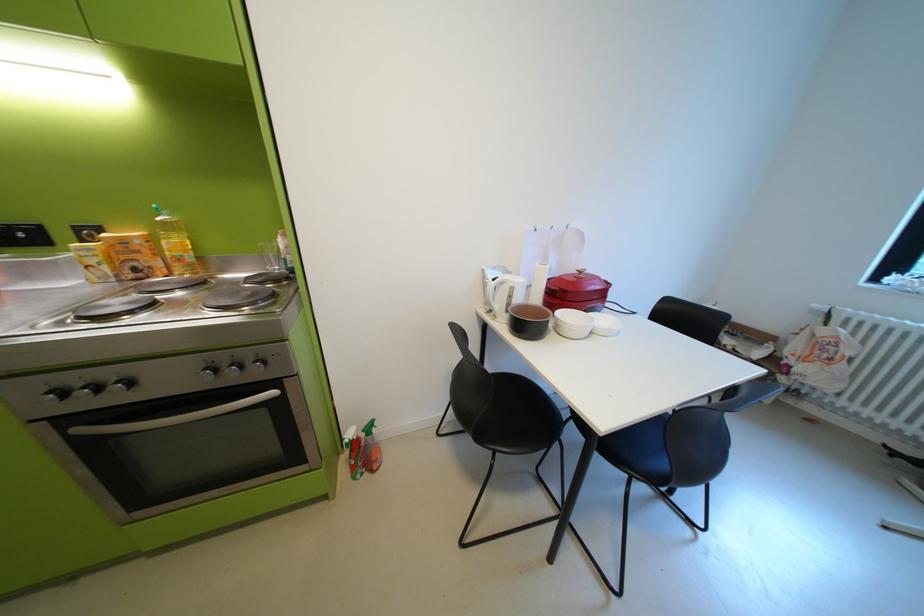
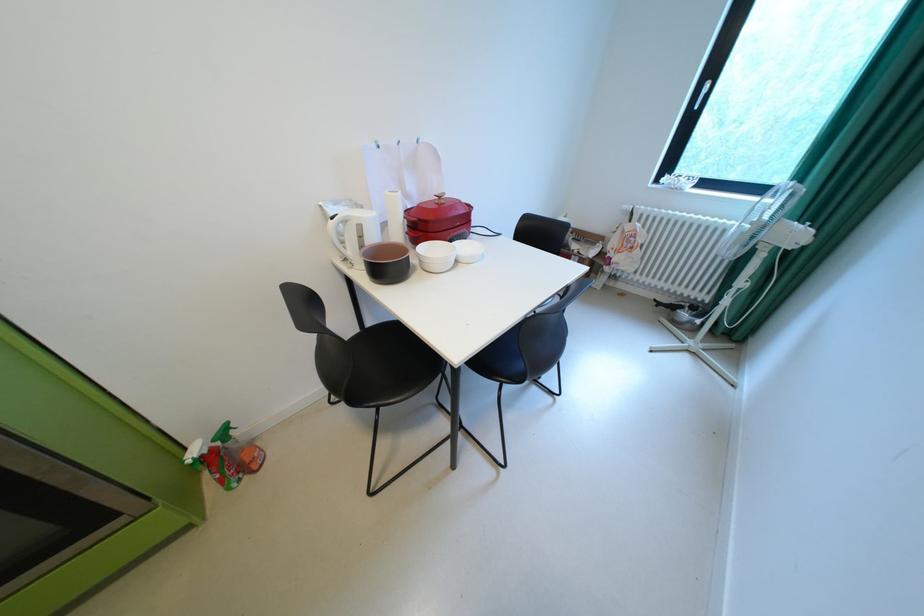
Find the pixel in the second image that matches (558,322) in the first image.

(419, 259)